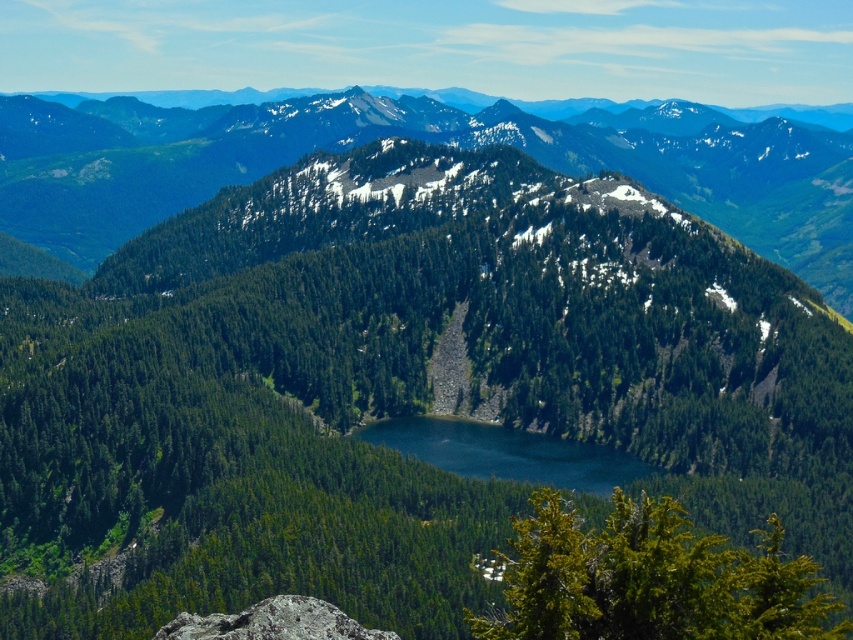
Does point (248, 180) come farther from viewer compared to point (505, 472)?

Yes, point (248, 180) is behind point (505, 472).

Is green forested mountain at center to the left of deep blue water at center from the viewer's perspective?

No, green forested mountain at center is not to the left of deep blue water at center.

Locate an element on the screen. green forested mountain at center is located at coordinates (426, 141).